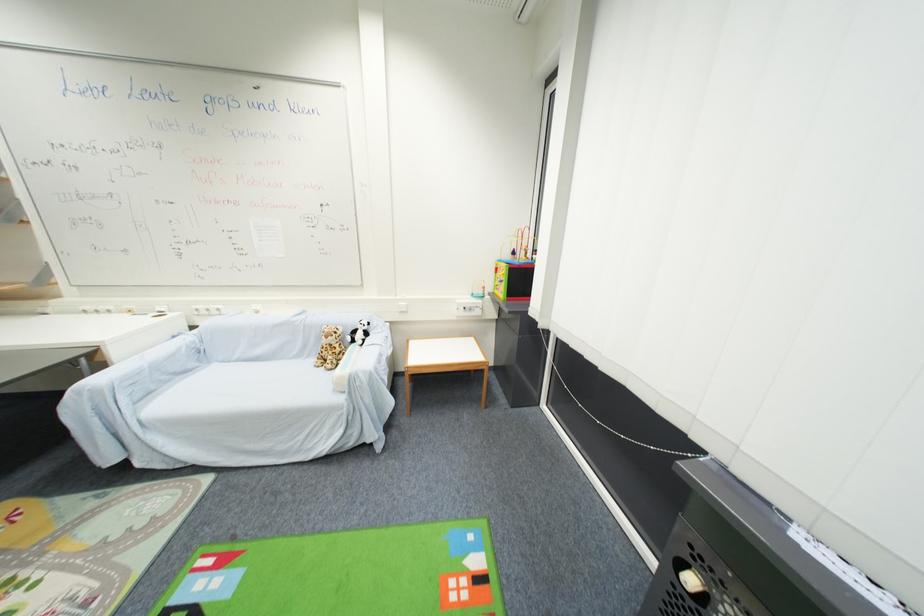
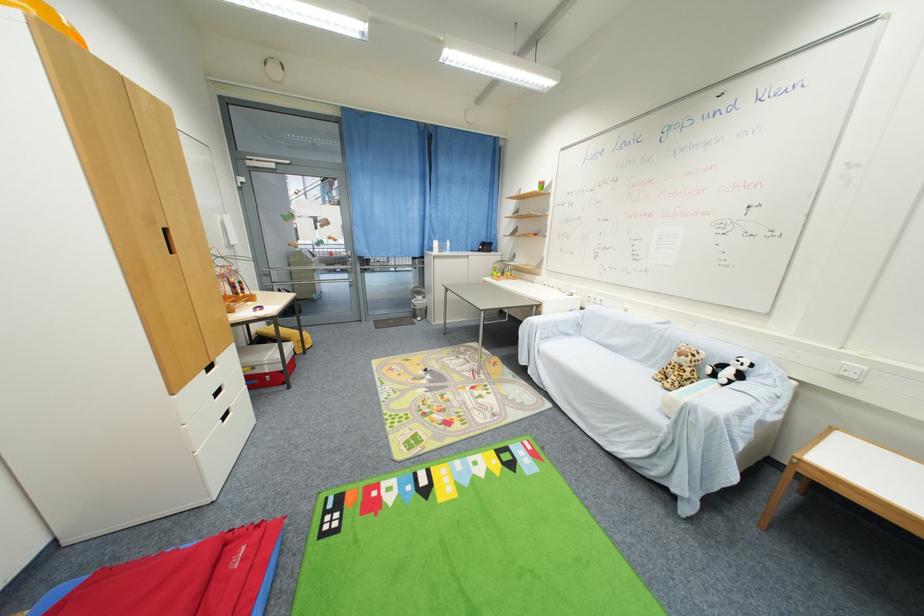
Where in the second image is the point corresponding to pixel 101 392 from the first image?

(537, 326)